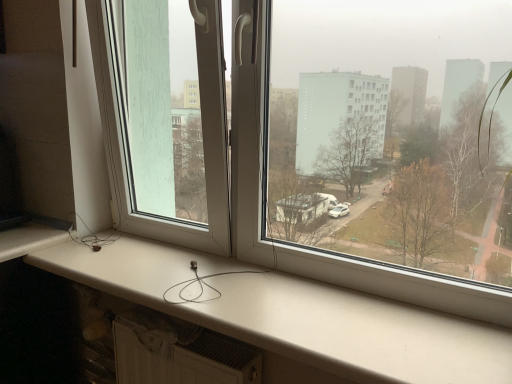
Question: From the image's perspective, relative to transparent plastic window screen at left, is white matte window sill at lower center above or below?

Choices:
 (A) above
 (B) below

Answer: (B)

Question: Based on their positions, is white matte window sill at lower center located to the left or right of transparent plastic window screen at left?

Choices:
 (A) right
 (B) left

Answer: (A)

Question: In terms of width, does white matte window sill at lower center look wider or thinner when compared to transparent plastic window screen at left?

Choices:
 (A) thin
 (B) wide

Answer: (B)

Question: Is transparent plastic window screen at left bigger or smaller than white matte window sill at lower center?

Choices:
 (A) small
 (B) big

Answer: (B)

Question: Looking at their shapes, would you say transparent plastic window screen at left is wider or thinner than white matte window sill at lower center?

Choices:
 (A) wide
 (B) thin

Answer: (B)

Question: From a real-world perspective, is transparent plastic window screen at left above or below white matte window sill at lower center?

Choices:
 (A) below
 (B) above

Answer: (B)

Question: From the image's perspective, is transparent plastic window screen at left above or below white matte window sill at lower center?

Choices:
 (A) above
 (B) below

Answer: (A)